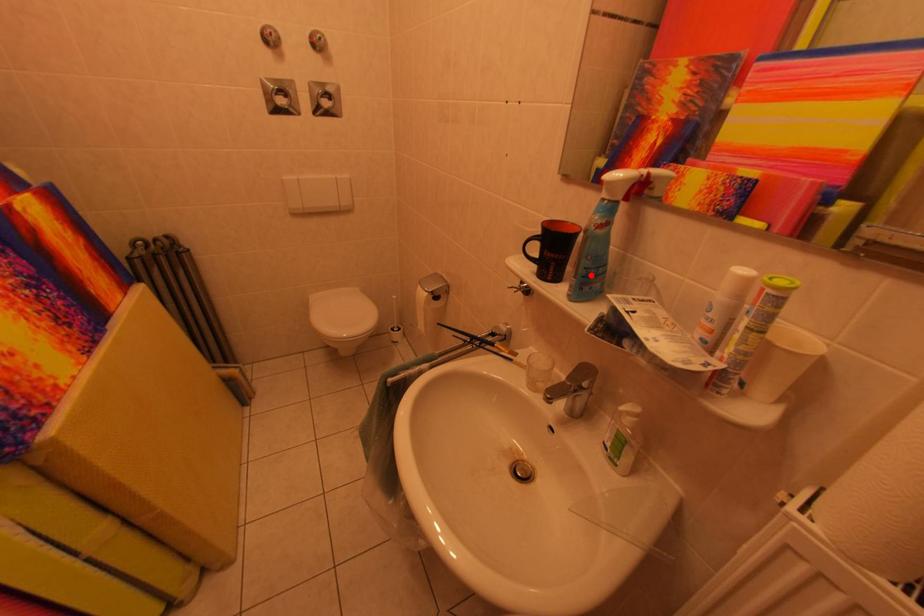
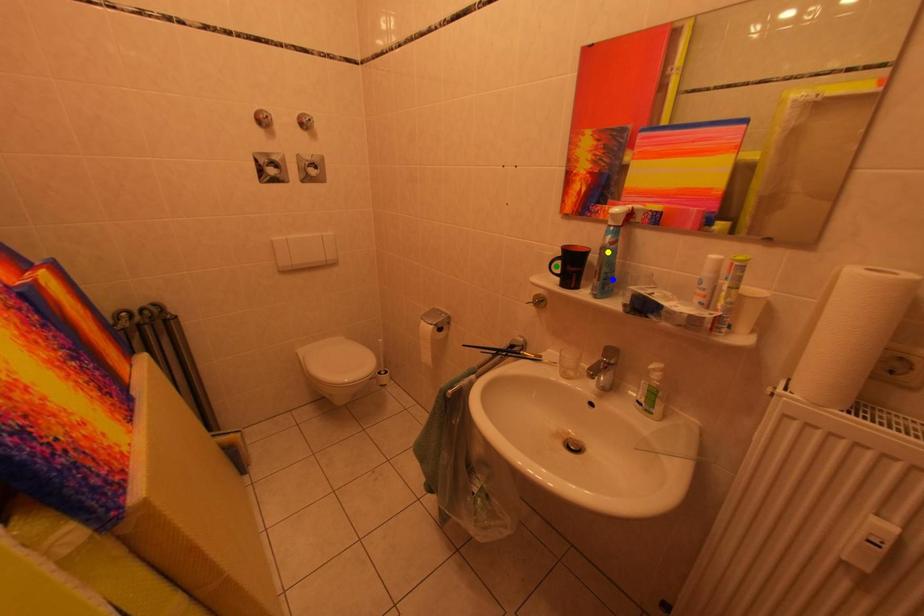
Question: I am providing you with two images of the same scene from different viewpoints. A red point is marked on the first image. You are given multiple points on the second image. Which point in image 2 represents the same 3d spot as the red point in image 1?

Choices:
 (A) green point
 (B) blue point
 (C) yellow point

Answer: (B)